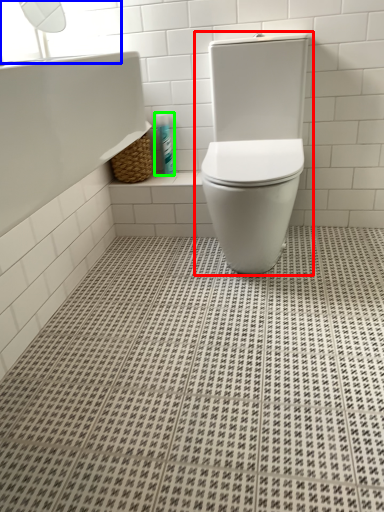
Question: Estimate the real-world distances between objects in this image. Which object is closer to toilet (highlighted by a red box), window screen (highlighted by a blue box) or toiletry (highlighted by a green box)?

Choices:
 (A) window screen
 (B) toiletry

Answer: (B)